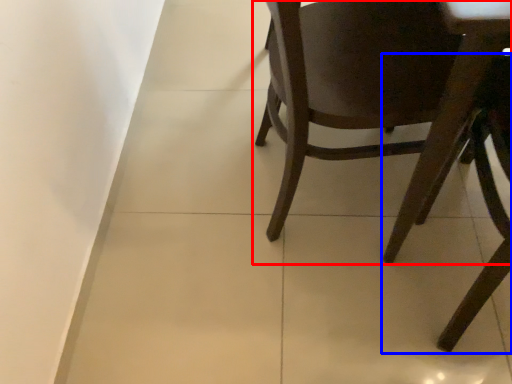
Question: Among these objects, which one is nearest to the camera, chair (highlighted by a red box) or chair (highlighted by a blue box)?

Choices:
 (A) chair
 (B) chair

Answer: (B)